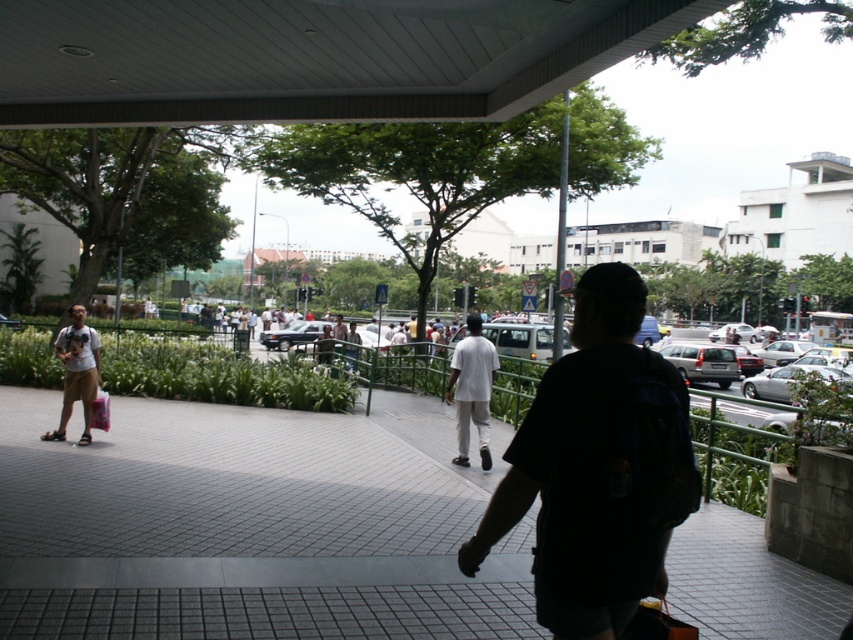
Locate an element on the screen. dark blue backpack at center is located at coordinates (590, 468).

Which is behind, point (529, 440) or point (74, 394)?

The point (74, 394) is more distant.

Where is `dark blue backpack at center`? The width and height of the screenshot is (853, 640). dark blue backpack at center is located at coordinates (590, 468).

Looking at this image, can you confirm if dark blue backpack at center is wider than white matte pants at center?

Yes.

Can you confirm if dark blue backpack at center is taller than white matte pants at center?

No, dark blue backpack at center is not taller than white matte pants at center.

Identify the location of dark blue backpack at center. (590, 468).

Is gray concrete pavement at center to the left of white matte pants at center from the viewer's perspective?

Yes, gray concrete pavement at center is to the left of white matte pants at center.

In the scene shown: Measure the distance between gray concrete pavement at center and camera.

3.63 meters

The width and height of the screenshot is (853, 640). Describe the element at coordinates (250, 524) in the screenshot. I see `gray concrete pavement at center` at that location.

Identify the location of gray concrete pavement at center. (250, 524).